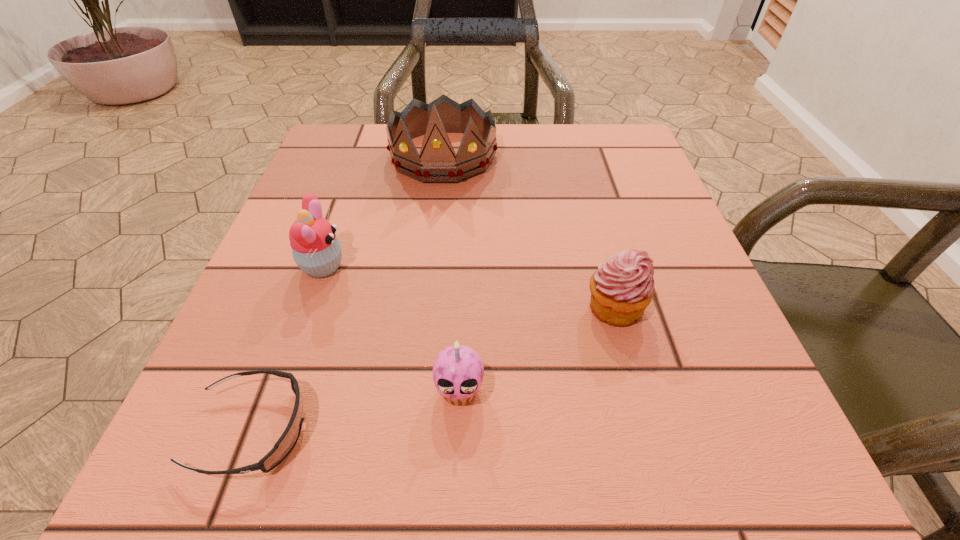
Image resolution: width=960 pixels, height=540 pixels. I want to click on vacant area that lies between the rightmost cupcake and the second cupcake from right to left, so click(537, 349).

At what (x,y) coordinates should I click in order to perform the action: click on unoccupied area between the leftmost cupcake and the rightmost object. Please return your answer as a coordinate pair (x, y). Image resolution: width=960 pixels, height=540 pixels. Looking at the image, I should click on (468, 287).

I want to click on object that is the second closest to the shortest object, so coord(316,250).

At what (x,y) coordinates should I click in order to perform the action: click on the second closest object to the rightmost object. Please return your answer as a coordinate pair (x, y). Looking at the image, I should click on (437, 162).

Identify the location of cupcake that is the nearest to the leftmost cupcake. The image size is (960, 540). (458, 372).

At what (x,y) coordinates should I click in order to perform the action: click on cupcake that stands as the closest to the rightmost cupcake. Please return your answer as a coordinate pair (x, y). Looking at the image, I should click on (458, 372).

Where is `free space that satisfies the following two spatial constraints: 1. at the front of the tallest object with jewels; 2. on the lenses of the goggles`? free space that satisfies the following two spatial constraints: 1. at the front of the tallest object with jewels; 2. on the lenses of the goggles is located at coordinates (413, 430).

Where is `vacant space that satisfies the following two spatial constraints: 1. at the front of the tallest object with jewels; 2. on the left side of the rightmost object`? Image resolution: width=960 pixels, height=540 pixels. vacant space that satisfies the following two spatial constraints: 1. at the front of the tallest object with jewels; 2. on the left side of the rightmost object is located at coordinates click(x=426, y=308).

Identify the location of blank space that satisfies the following two spatial constraints: 1. on the face of the leftmost cupcake; 2. on the right side of the rightmost object. The height and width of the screenshot is (540, 960). click(x=308, y=308).

Where is `free region that satisfies the following two spatial constraints: 1. at the front of the tiara with jewels; 2. on the lenses of the goggles`? The width and height of the screenshot is (960, 540). free region that satisfies the following two spatial constraints: 1. at the front of the tiara with jewels; 2. on the lenses of the goggles is located at coordinates (413, 430).